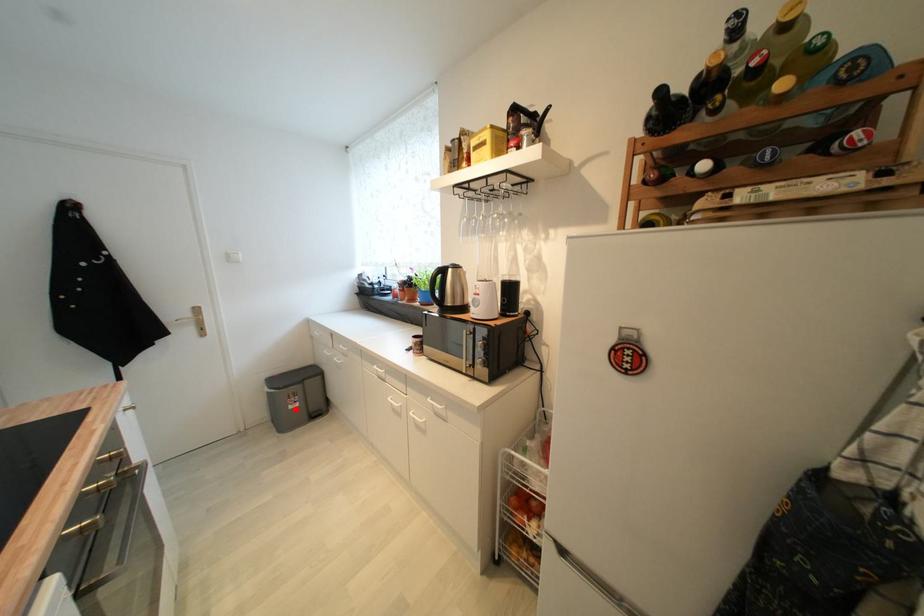
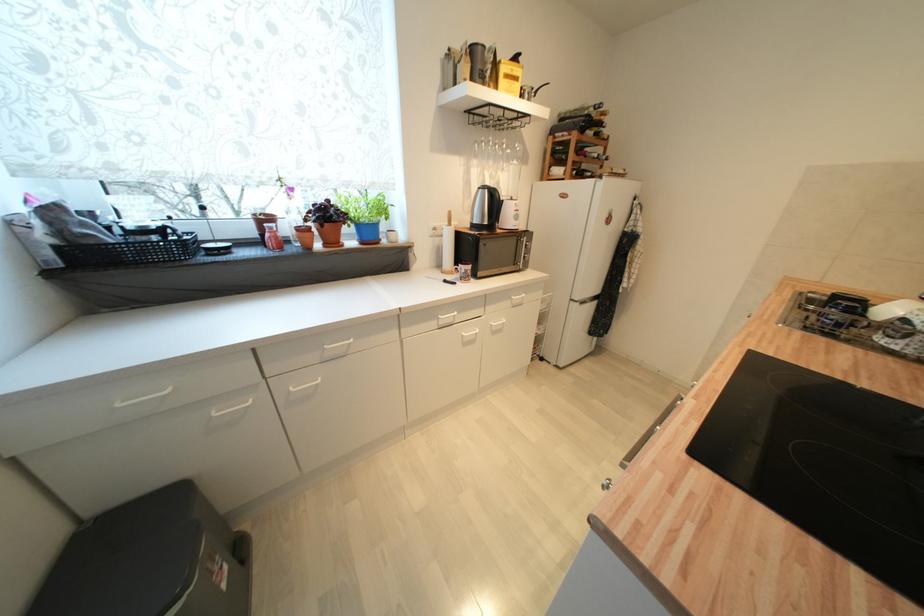
In the second image, find the point that corresponds to the highlighted location in the first image.

(228, 588)